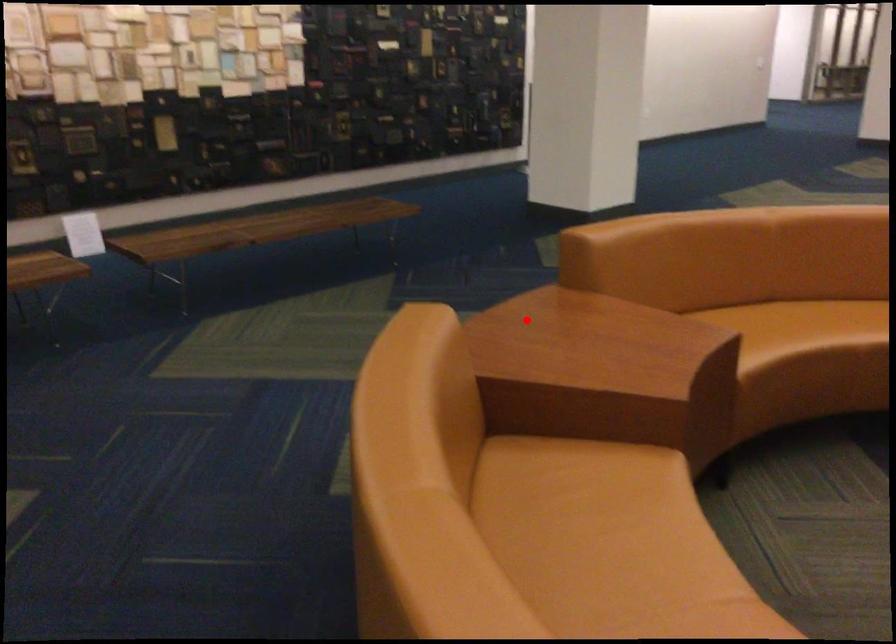
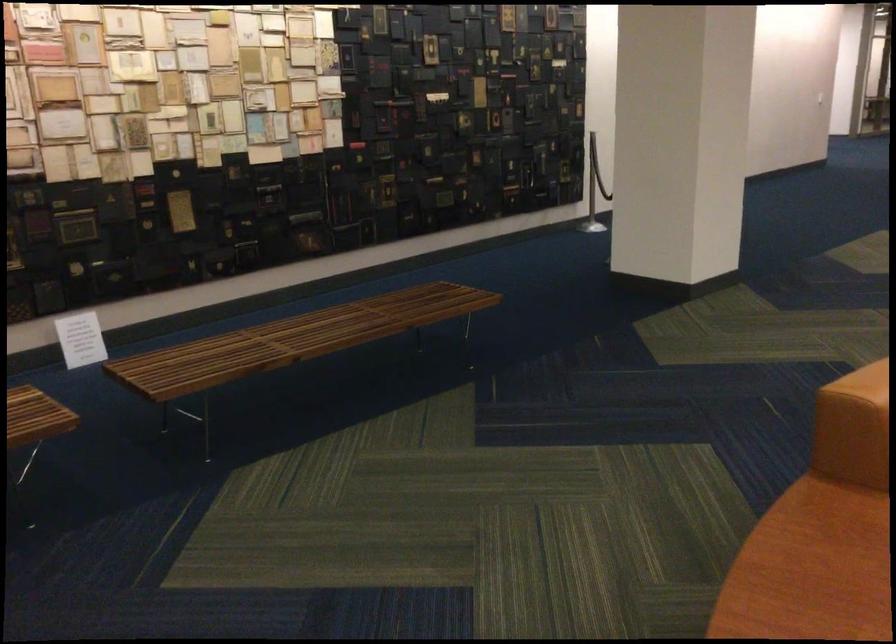
Find the pixel in the second image that matches the highlighted location in the first image.

(811, 569)